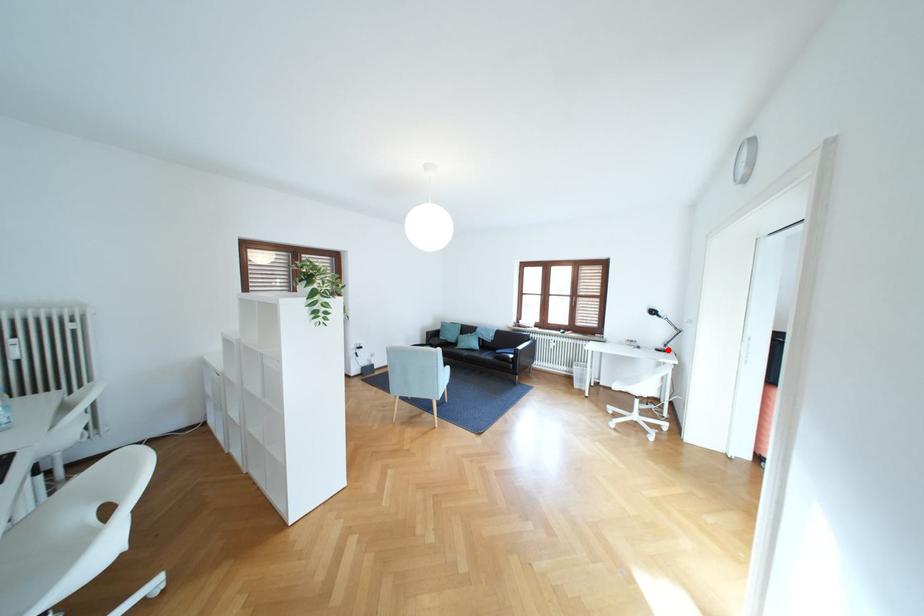
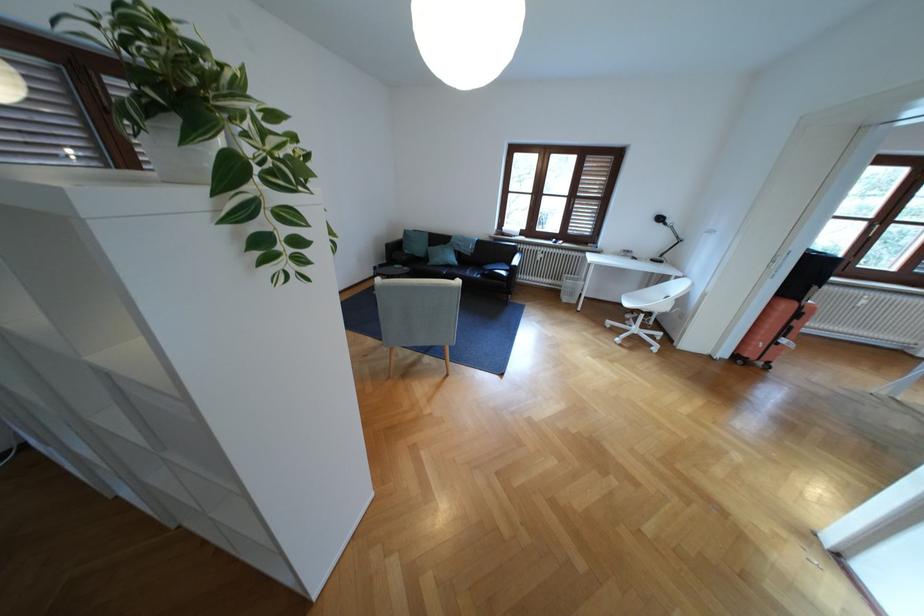
In the second image, find the point that corresponds to the highlighted location in the first image.

(663, 261)